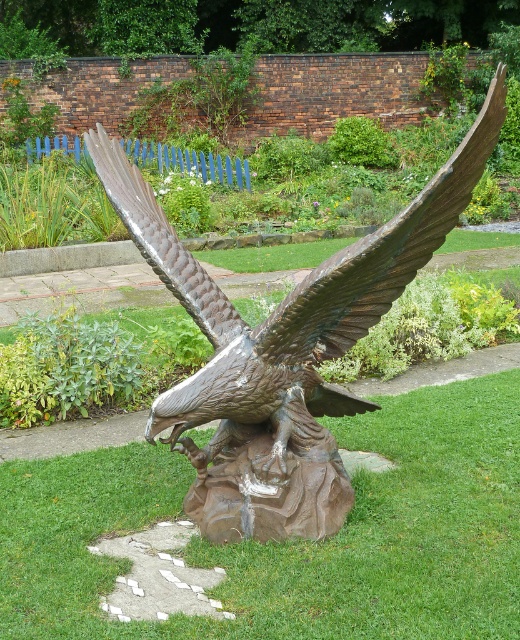
You are a gardener looking at the bronze eagle at center and the shiny bronze wing at upper center in the garden. Which object is located to the left of the other?

The bronze eagle at center is positioned on the right side of the shiny bronze wing at upper center, so the shiny bronze wing at upper center is to the left of the bronze eagle at center.

You are a landscape architect designing a new garden layout. You need to place a new statue exactly 4 meters away from the green grass at center. Based on the current scene, is this feasible? Please explain.

The distance between the green grass at center and the camera is 3.52 meters. To place a new statue 4 meters away from the green grass at center, you would need to position it beyond the current camera position, as the existing distance is less than the required 4 meters.